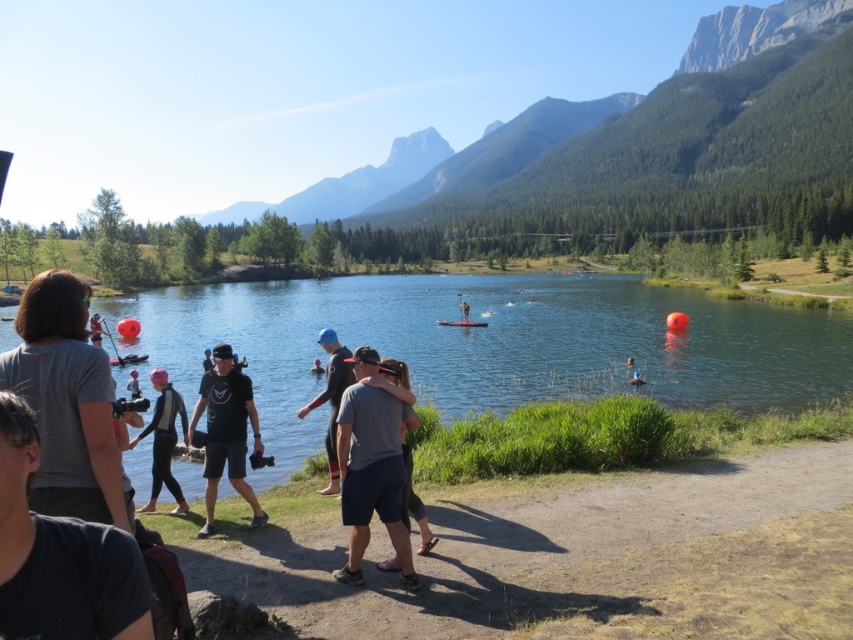
Who is higher up, black wetsuit at center or orange buoyant float at center?

Positioned higher is orange buoyant float at center.

Between point (177, 493) and point (126, 362), which one is positioned in front?

Positioned in front is point (177, 493).

Find the location of a particular element. Image resolution: width=853 pixels, height=640 pixels. black wetsuit at center is located at coordinates (163, 440).

Does point (254, 435) lie behind point (401, 384)?

Yes.

Between point (248, 387) and point (380, 374), which one is positioned behind?

Point (248, 387)

Where is `black matte t-shirt at center`? The height and width of the screenshot is (640, 853). black matte t-shirt at center is located at coordinates pos(225,433).

Can you confirm if red plastic boat at center is thinner than black matte wetsuit at center?

Yes.

In the scene shown: Can you confirm if red plastic boat at center is taller than black matte wetsuit at center?

In fact, red plastic boat at center may be shorter than black matte wetsuit at center.

Who is more forward, (485, 324) or (207, 356)?

Positioned in front is point (207, 356).

This screenshot has width=853, height=640. I want to click on red plastic boat at center, so click(x=462, y=323).